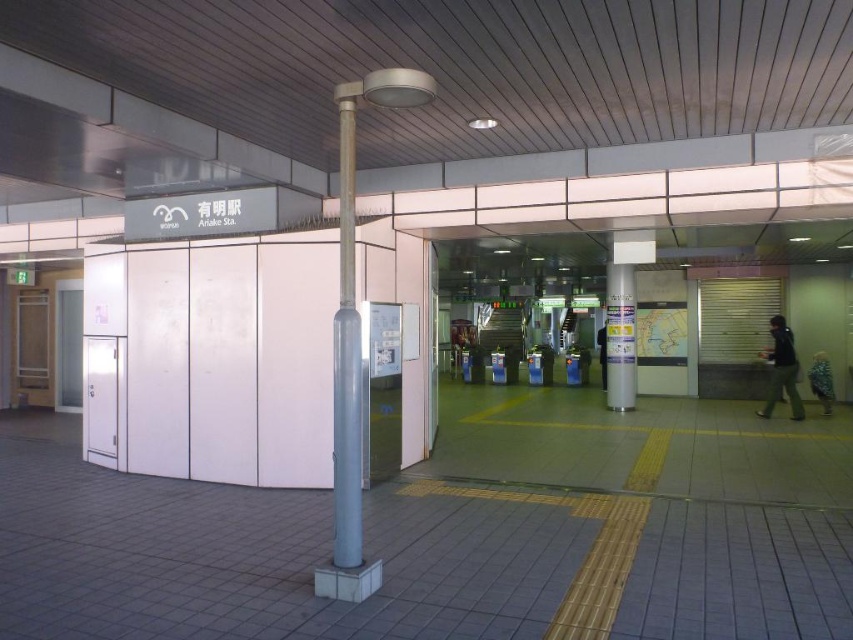
You are standing at Ariake Station and want to take a photo of the two points marked in the scene. Which point should you focus on first to ensure both are in focus? The points are located at coordinates point [630,330] and point [827,384]. Please choose between the two based on their positions.

You should focus on point [630,330] first because it is closer to the camera than point [827,384]. By focusing on the closer point, the farther point will also be within the depth of field, ensuring both are in focus.

You are a photographer setting up a tripod in Ariake Station. You need to position it so that both the white glossy pillar at center and the dark gray fabric jacket at right are visible in the frame. Given their heights, which object will appear larger in the photo?

The white glossy pillar at center is taller than the dark gray fabric jacket at right, so it will appear larger in the photo.

You are a passenger at Ariake Station and see a dark gray fabric jacket at right and a blue patterned shirt at right. Which clothing item is closer to you?

The dark gray fabric jacket at right is closer to you because it is in front of the blue patterned shirt at right.